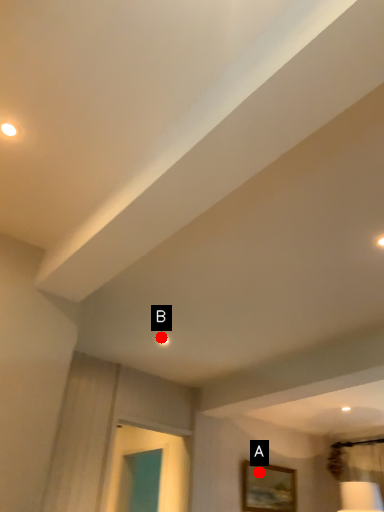
Question: Two points are circled on the image, labeled by A and B beside each circle. Among these points, which one is farthest from the camera?

Choices:
 (A) A is further
 (B) B is further

Answer: (A)